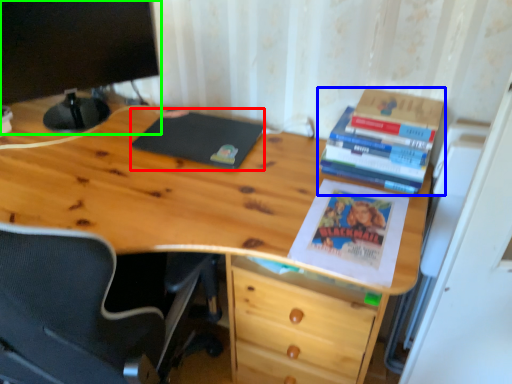
Question: Which is farther away from notebook (highlighted by a red box)? book (highlighted by a blue box) or computer monitor (highlighted by a green box)?

Choices:
 (A) book
 (B) computer monitor

Answer: (A)